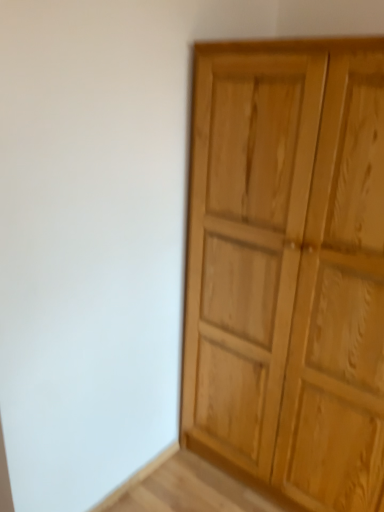
Question: Should I look upward or downward to see natural wood cupboard at right?

Choices:
 (A) up
 (B) down

Answer: (B)